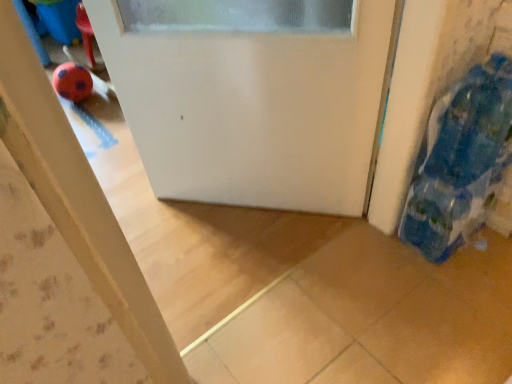
What do you see at coordinates (461, 161) in the screenshot?
I see `blue fabric bag at right` at bounding box center [461, 161].

Identify the location of blue fabric bag at right. This screenshot has width=512, height=384. (461, 161).

What do you see at coordinates (253, 96) in the screenshot? Image resolution: width=512 pixels, height=384 pixels. I see `white matte door at center` at bounding box center [253, 96].

Where is `white matte door at center`? This screenshot has height=384, width=512. white matte door at center is located at coordinates (253, 96).

Locate an element on the screen. This screenshot has width=512, height=384. blue fabric bag at right is located at coordinates (461, 161).

Does blue fabric bag at right appear on the right side of white matte door at center?

Indeed, blue fabric bag at right is positioned on the right side of white matte door at center.

Does blue fabric bag at right come in front of white matte door at center?

Yes.

Which is closer to the camera, (433, 208) or (133, 11)?

Clearly, point (433, 208) is more distant from the camera than point (133, 11).

From the image's perspective, relative to white matte door at center, is blue fabric bag at right above or below?

Clearly, from the image's perspective, blue fabric bag at right is below white matte door at center.

From a real-world perspective, is blue fabric bag at right above or below white matte door at center?

blue fabric bag at right is situated higher than white matte door at center in the real world.

Which object is thinner, blue fabric bag at right or white matte door at center?

white matte door at center is thinner.

Does blue fabric bag at right have a greater height compared to white matte door at center?

Incorrect, the height of blue fabric bag at right is not larger of that of white matte door at center.

Based on their sizes in the image, would you say blue fabric bag at right is bigger or smaller than white matte door at center?

In the image, blue fabric bag at right appears to be smaller than white matte door at center.

Could white matte door at center be considered to be inside blue fabric bag at right?

No, white matte door at center is not surrounded by blue fabric bag at right.

Does blue fabric bag at right touch white matte door at center?

No, blue fabric bag at right is not in contact with white matte door at center.

Is blue fabric bag at right positioned with its back to white matte door at center?

No, blue fabric bag at right is not facing away from white matte door at center.

Measure the distance from blue fabric bag at right to white matte door at center.

blue fabric bag at right is 16.51 inches from white matte door at center.

This screenshot has height=384, width=512. Find the location of `door on the left of the blue fabric bag at right`. door on the left of the blue fabric bag at right is located at coordinates [253, 96].

Between white matte door at center and blue fabric bag at right, which one appears on the left side from the viewer's perspective?

white matte door at center.

In the image, is white matte door at center positioned in front of or behind blue fabric bag at right?

In the image, white matte door at center appears behind blue fabric bag at right.

Is point (185, 131) closer or farther from the camera than point (498, 104)?

Point (185, 131).

From the image's perspective, which one is positioned higher, white matte door at center or blue fabric bag at right?

white matte door at center, from the image's perspective.

From a real-world perspective, does white matte door at center sit lower than blue fabric bag at right?

Yes.

Looking at their sizes, would you say white matte door at center is wider or thinner than blue fabric bag at right?

In the image, white matte door at center appears to be more narrow than blue fabric bag at right.

From the picture: Between white matte door at center and blue fabric bag at right, which one has less height?

Standing shorter between the two is blue fabric bag at right.

Who is bigger, white matte door at center or blue fabric bag at right?

Bigger between the two is white matte door at center.

Could blue fabric bag at right be considered to be inside white matte door at center?

No, blue fabric bag at right is not surrounded by white matte door at center.

Is white matte door at center not near blue fabric bag at right?

No, there isn't a large distance between white matte door at center and blue fabric bag at right.

Is white matte door at center positioned with its back to blue fabric bag at right?

white matte door at center is not turned away from blue fabric bag at right.

Locate an element on the screen. door that is above the blue fabric bag at right (from the image's perspective) is located at coordinates (253, 96).

Where is `door lying on the left of blue fabric bag at right`? door lying on the left of blue fabric bag at right is located at coordinates (253, 96).

I want to click on door that appears above the blue fabric bag at right (from the image's perspective), so click(253, 96).